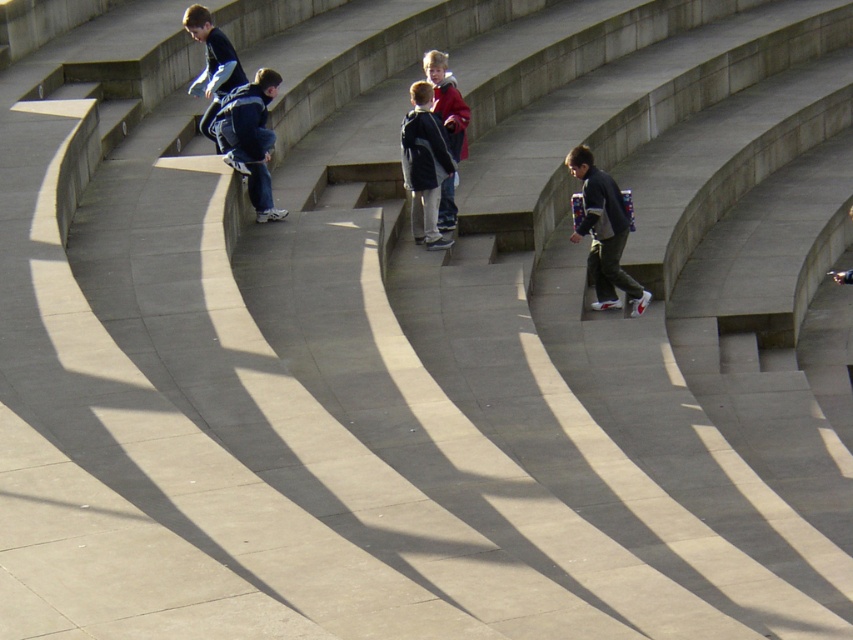
Question: In this image, where is dark blue hoodie at center located relative to dark blue jacket at center?

Choices:
 (A) right
 (B) left

Answer: (B)

Question: Is dark gray fabric backpack at center further to camera compared to dark blue hoodie at center?

Choices:
 (A) yes
 (B) no

Answer: (B)

Question: Which point appears farthest from the camera in this image?

Choices:
 (A) (462, 145)
 (B) (583, 147)

Answer: (A)

Question: Among these points, which one is farthest from the camera?

Choices:
 (A) (589, 196)
 (B) (450, 77)

Answer: (B)

Question: Based on their relative distances, which object is nearer to the dark blue hoodie at center?

Choices:
 (A) dark gray fabric backpack at center
 (B) dark blue jacket at center
 (C) red matte jacket at center

Answer: (B)

Question: Where is dark gray fabric backpack at center located in relation to dark blue hoodie at center in the image?

Choices:
 (A) left
 (B) right

Answer: (B)